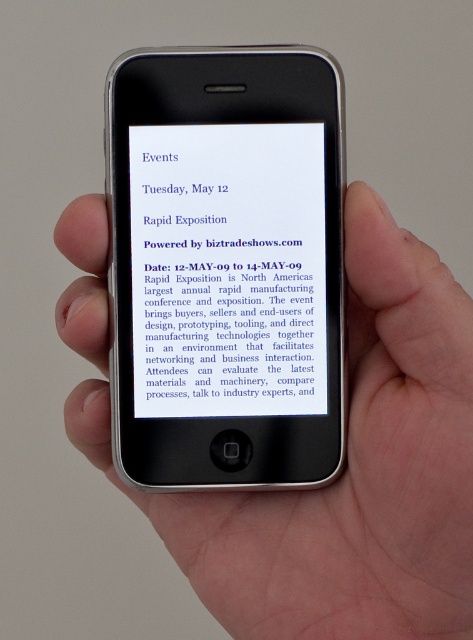
Is black plastic phone at center smaller than blue paper at center?

No.

Does black plastic phone at center have a lesser width compared to blue paper at center?

Incorrect, black plastic phone at center's width is not less than blue paper at center's.

Is point (294, 461) positioned in front of point (227, 180)?

Yes.

Where is `black plastic phone at center`? black plastic phone at center is located at coordinates (226, 268).

Does point (431, 388) lie behind point (199, 376)?

That is False.

Does black matte phone at center have a greater width compared to blue paper at center?

Yes.

This screenshot has width=473, height=640. What do you see at coordinates (346, 472) in the screenshot? I see `black matte phone at center` at bounding box center [346, 472].

Find the location of `black matte phone at center`. black matte phone at center is located at coordinates (346, 472).

Can you confirm if black plastic phone at center is positioned to the left of black matte phone at center?

Yes, black plastic phone at center is to the left of black matte phone at center.

Looking at this image, is black plastic phone at center wider than black matte phone at center?

Incorrect, black plastic phone at center's width does not surpass black matte phone at center's.

Describe the element at coordinates (226, 268) in the screenshot. I see `black plastic phone at center` at that location.

The width and height of the screenshot is (473, 640). I want to click on black plastic phone at center, so click(x=226, y=268).